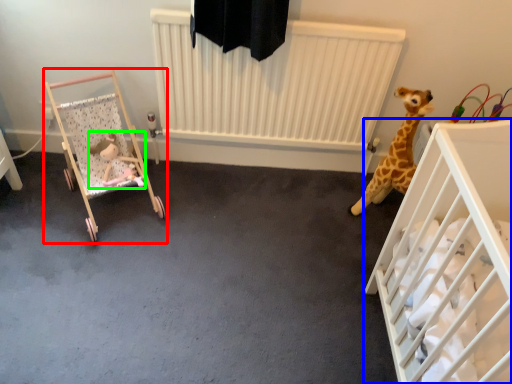
Question: Which object is the farthest from infant bed (highlighted by a red box)? Choose among these: infant bed (highlighted by a blue box) or toy (highlighted by a green box).

Choices:
 (A) infant bed
 (B) toy

Answer: (A)